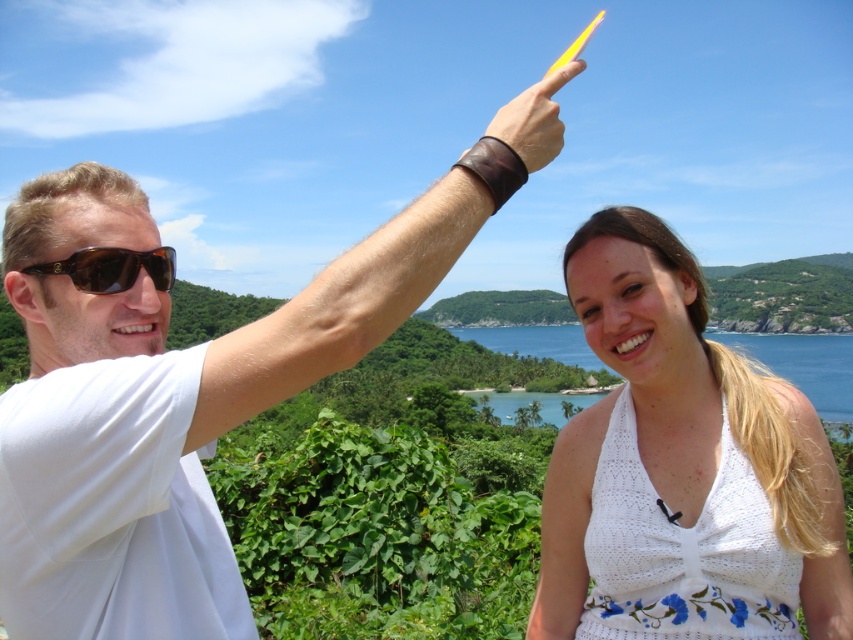
Question: Which point appears farthest from the camera in this image?

Choices:
 (A) (514, 148)
 (B) (68, 257)
 (C) (82, 532)

Answer: (B)

Question: Can you confirm if white crochet dress at center is positioned below yellow plastic stick at upper center?

Choices:
 (A) no
 (B) yes

Answer: (B)

Question: Which object appears closest to the camera in this image?

Choices:
 (A) brown matte sunglasses at upper left
 (B) leather wristband at upper center
 (C) yellow plastic stick at upper center
 (D) white crochet dress at center

Answer: (B)

Question: From the image, what is the correct spatial relationship of matte white shirt at upper left in relation to brown matte sunglasses at upper left?

Choices:
 (A) right
 (B) left

Answer: (B)

Question: Is white crochet dress at center further to the viewer compared to yellow plastic stick at upper center?

Choices:
 (A) no
 (B) yes

Answer: (B)

Question: Which object is closer to the camera taking this photo?

Choices:
 (A) leather wristband at upper center
 (B) yellow plastic stick at upper center
 (C) matte white shirt at upper left

Answer: (C)